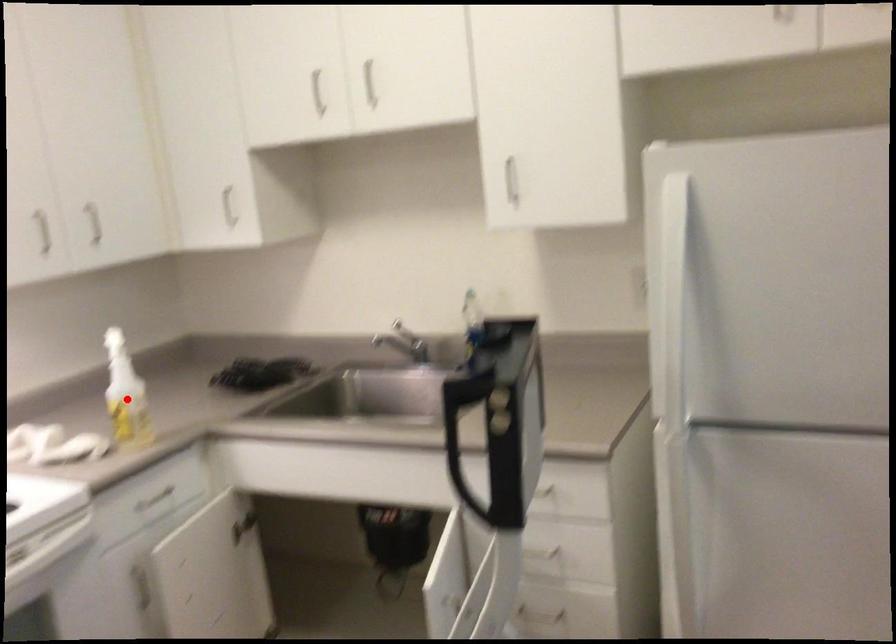
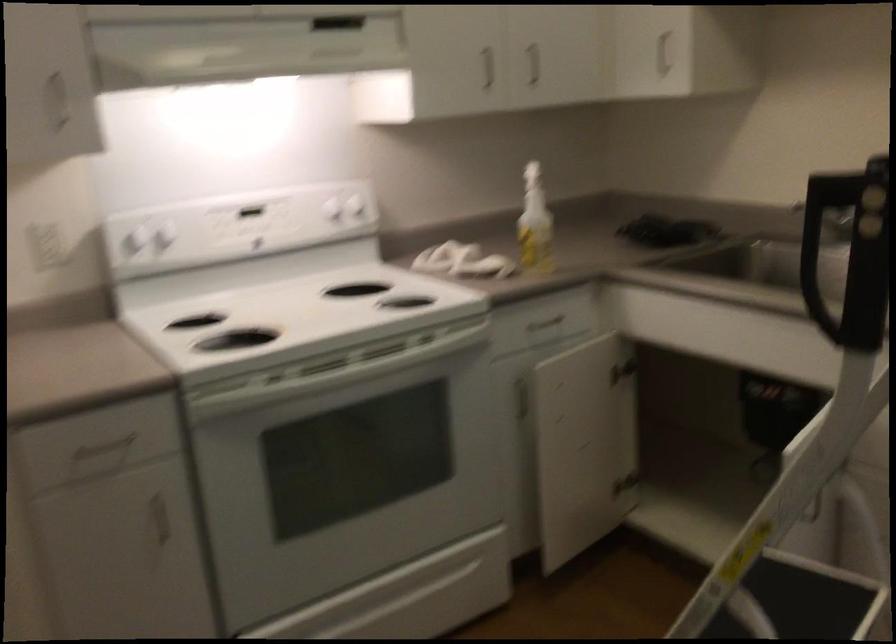
The point at the highlighted location is marked in the first image. Where is the corresponding point in the second image?

(535, 223)